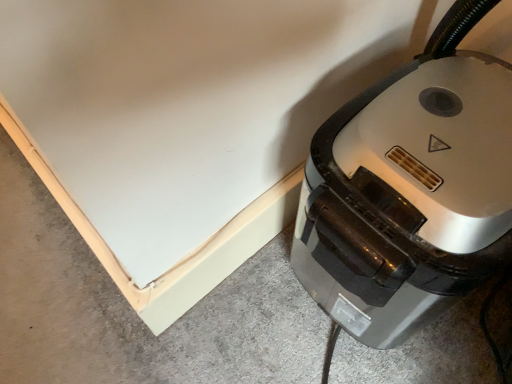
Question: Looking at their shapes, would you say metallic gray vacuum cleaner at lower right is wider or thinner than gray concrete at lower left?

Choices:
 (A) wide
 (B) thin

Answer: (B)

Question: Is metallic gray vacuum cleaner at lower right bigger or smaller than gray concrete at lower left?

Choices:
 (A) small
 (B) big

Answer: (B)

Question: Would you say metallic gray vacuum cleaner at lower right is to the left or to the right of gray concrete at lower left in the picture?

Choices:
 (A) right
 (B) left

Answer: (A)

Question: Is gray concrete at lower left bigger or smaller than metallic gray vacuum cleaner at lower right?

Choices:
 (A) small
 (B) big

Answer: (A)

Question: Is gray concrete at lower left wider or thinner than metallic gray vacuum cleaner at lower right?

Choices:
 (A) thin
 (B) wide

Answer: (B)

Question: Is gray concrete at lower left spatially inside metallic gray vacuum cleaner at lower right, or outside of it?

Choices:
 (A) inside
 (B) outside

Answer: (B)

Question: Relative to metallic gray vacuum cleaner at lower right, is gray concrete at lower left in front or behind?

Choices:
 (A) behind
 (B) front

Answer: (A)